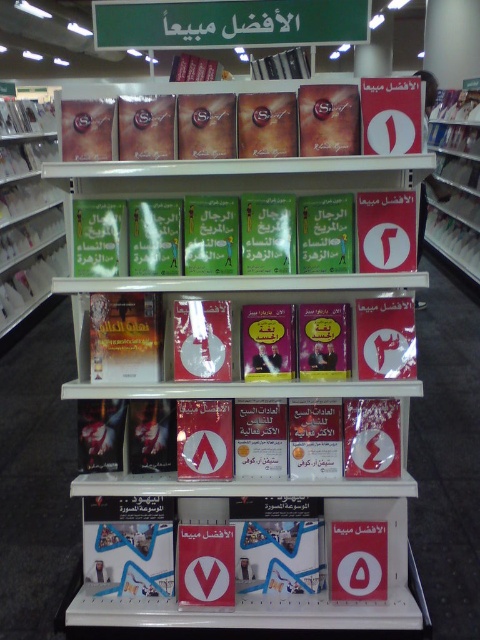
Question: Which of these objects is positioned closest to the red matte book at center?

Choices:
 (A) greenmaterial/texturesign at upper center
 (B) matte cardboard book at upper center
 (C) matte plastic book at left
 (D) matte paper book at center

Answer: (C)

Question: Where is matte plastic book at left located in relation to matte paper book at center in the image?

Choices:
 (A) below
 (B) above

Answer: (B)

Question: Which of the following is the farthest from the observer?

Choices:
 (A) (363, 392)
 (B) (13, 104)
 (C) (100, 394)
 (D) (440, 236)

Answer: (D)

Question: Which point is farther from the camera taking this photo?

Choices:
 (A) (178, 589)
 (B) (242, 390)
 (C) (299, 40)
 (D) (26, 288)

Answer: (D)

Question: Is greenmaterial/texturesign at upper center above red matte book at center?

Choices:
 (A) no
 (B) yes

Answer: (A)

Question: Can you confirm if matte cardboard book at upper center is wider than matte paper book at center?

Choices:
 (A) no
 (B) yes

Answer: (B)